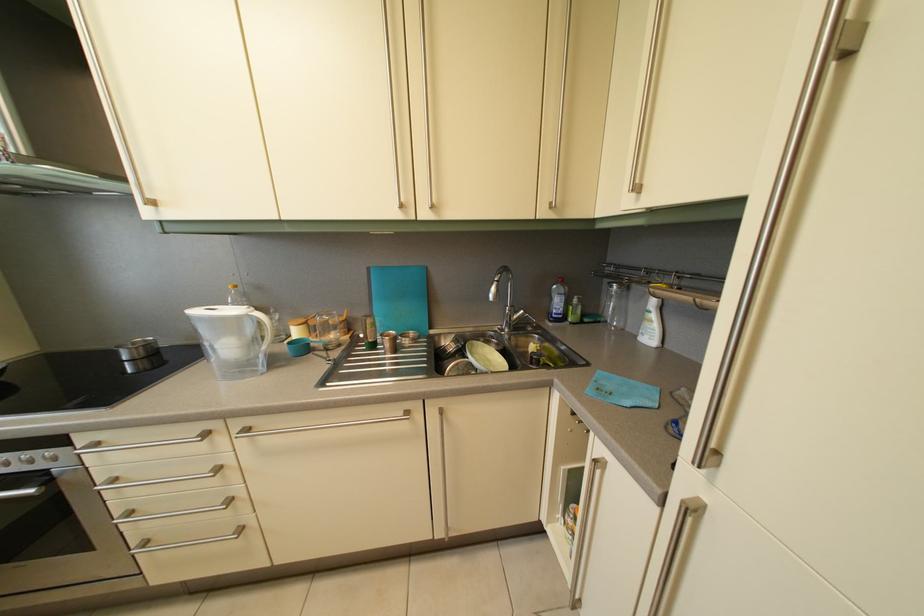
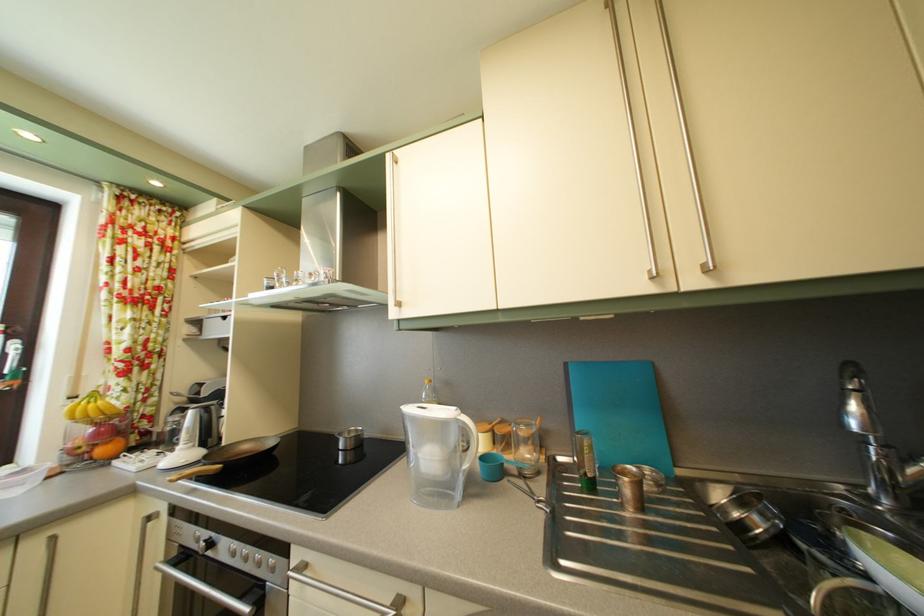
First-person continuous shooting, in which direction is the camera rotating?

The camera rotated toward left-up.